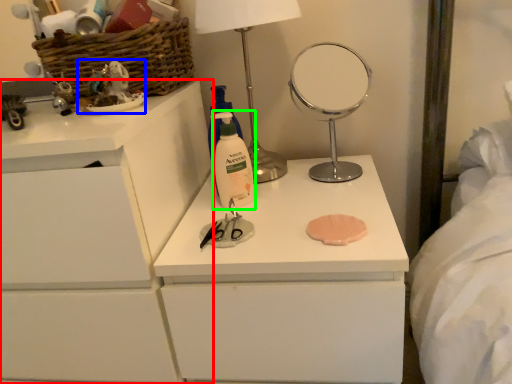
Question: Which object is the farthest from chest of drawers (highlighted by a red box)? Choose among these: toy (highlighted by a blue box) or cleaning product (highlighted by a green box).

Choices:
 (A) toy
 (B) cleaning product

Answer: (B)